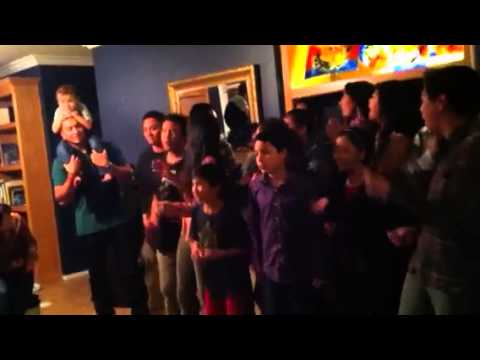
Where is `floor`? This screenshot has height=360, width=480. floor is located at coordinates (65, 303).